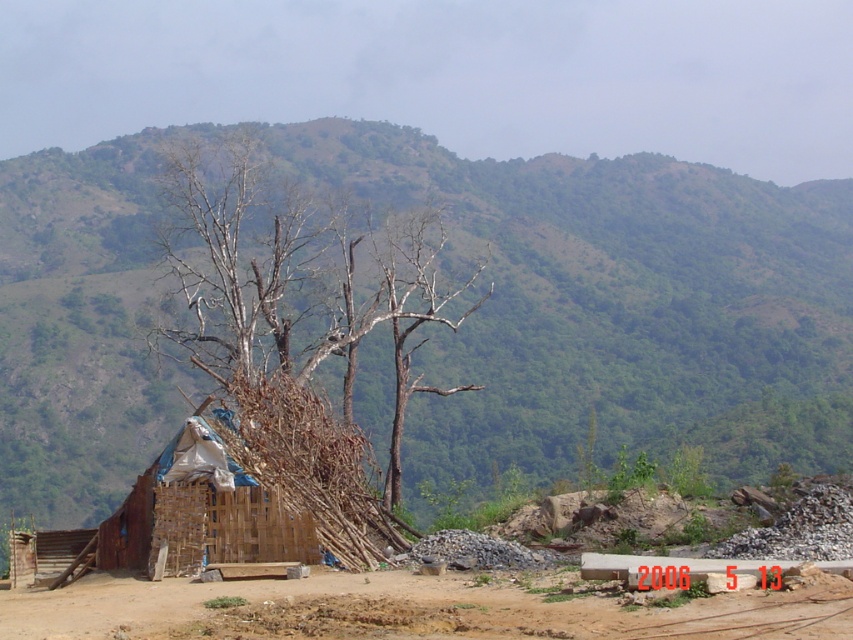
Question: Which point appears closest to the camera in this image?

Choices:
 (A) (288, 317)
 (B) (740, 636)

Answer: (B)

Question: Which object is positioned farthest from the green leafy mountain at upper center?

Choices:
 (A) wooden hut at lower left
 (B) brown dirt field at lower center

Answer: (A)

Question: Can you confirm if green leafy mountain at upper center is wider than wooden hut at lower left?

Choices:
 (A) yes
 (B) no

Answer: (A)

Question: Is brown dry wood at center closer to camera compared to brown dirt field at lower center?

Choices:
 (A) no
 (B) yes

Answer: (A)

Question: Which point appears farthest from the camera in this image?

Choices:
 (A) (729, 266)
 (B) (161, 516)
 (C) (566, 596)
 (D) (328, 472)

Answer: (A)

Question: Considering the relative positions of brown dry wood at center and brown dirt field at lower center in the image provided, where is brown dry wood at center located with respect to brown dirt field at lower center?

Choices:
 (A) below
 (B) above

Answer: (B)